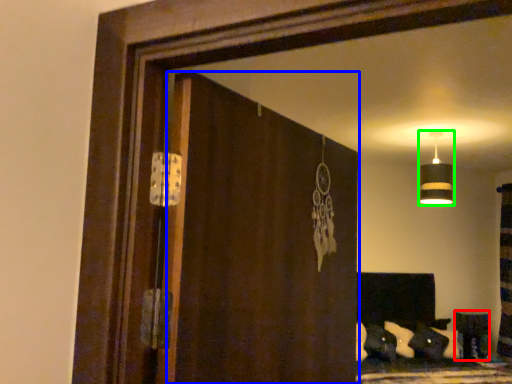
Question: Estimate the real-world distances between objects in this image. Which object is farther from furniture (highlighted by a red box), screen door (highlighted by a blue box) or lamp (highlighted by a green box)?

Choices:
 (A) screen door
 (B) lamp

Answer: (A)